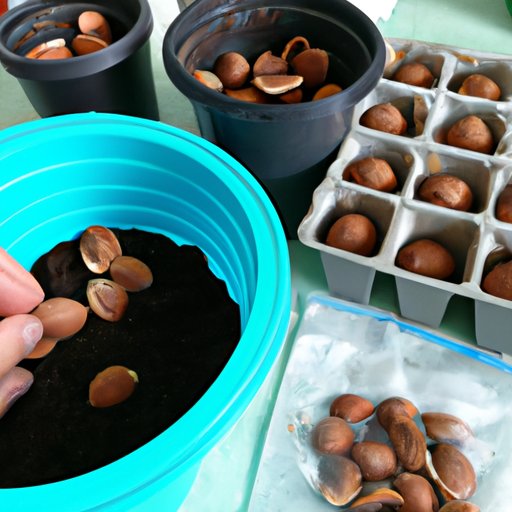
Where is `counter top`? The image size is (512, 512). counter top is located at coordinates (253, 413), (311, 260), (177, 106), (13, 99), (167, 10).